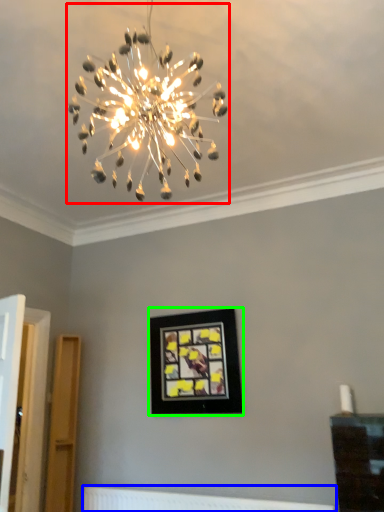
Question: Which object is the farthest from lamp (highlighted by a red box)? Choose among these: radiator (highlighted by a blue box) or picture frame (highlighted by a green box).

Choices:
 (A) radiator
 (B) picture frame

Answer: (A)